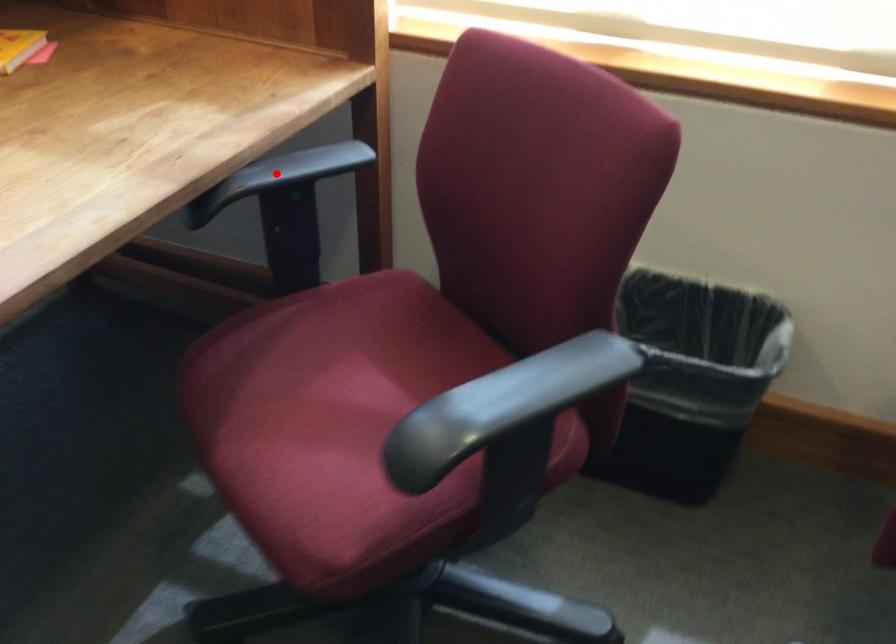
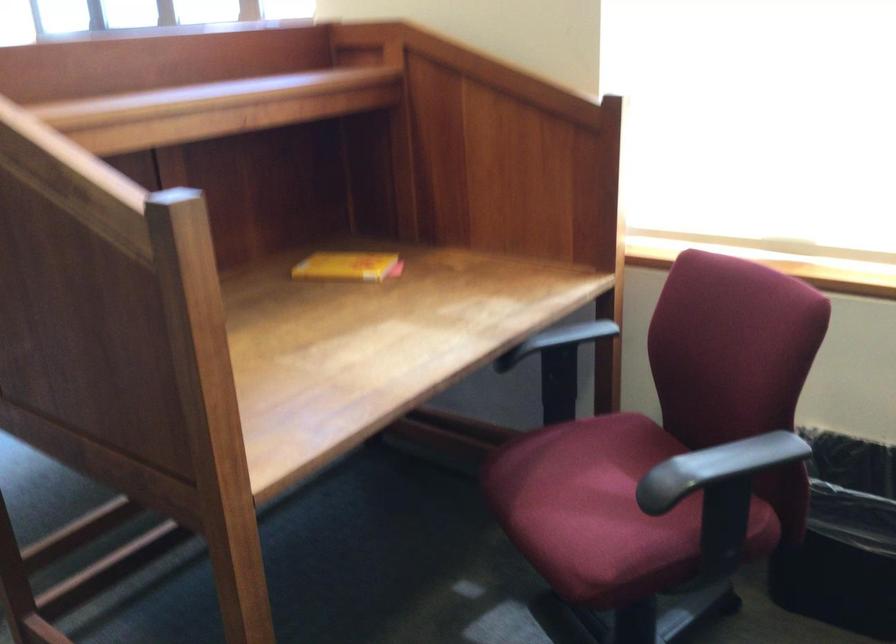
Question: I am providing you with two images of the same scene from different viewpoints. A red point is marked on the first image. Is the red point's position out of view in image 2?

Choices:
 (A) Yes
 (B) No

Answer: (B)